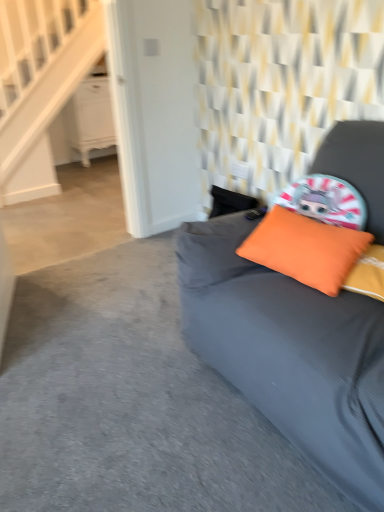
Question: From the image's perspective, is matte gray studio couch at center below orange fabric pillow at upper right?

Choices:
 (A) yes
 (B) no

Answer: (A)

Question: Is matte gray studio couch at center not within orange fabric pillow at upper right?

Choices:
 (A) no
 (B) yes

Answer: (B)

Question: From a real-world perspective, is matte gray studio couch at center positioned over orange fabric pillow at upper right based on gravity?

Choices:
 (A) no
 (B) yes

Answer: (A)

Question: Is matte gray studio couch at center wider than orange fabric pillow at upper right?

Choices:
 (A) no
 (B) yes

Answer: (B)

Question: Does matte gray studio couch at center come in front of orange fabric pillow at upper right?

Choices:
 (A) no
 (B) yes

Answer: (B)

Question: Which is correct: white glossy dresser at upper left is inside matte gray studio couch at center, or outside of it?

Choices:
 (A) inside
 (B) outside

Answer: (B)

Question: Visually, is white glossy dresser at upper left positioned to the left or to the right of matte gray studio couch at center?

Choices:
 (A) right
 (B) left

Answer: (B)

Question: Is point (105, 101) closer or farther from the camera than point (375, 494)?

Choices:
 (A) farther
 (B) closer

Answer: (A)

Question: From their relative heights in the image, would you say white glossy dresser at upper left is taller or shorter than matte gray studio couch at center?

Choices:
 (A) short
 (B) tall

Answer: (A)

Question: From their relative heights in the image, would you say orange fabric pillow at upper right is taller or shorter than matte gray studio couch at center?

Choices:
 (A) short
 (B) tall

Answer: (A)

Question: Considering the positions of orange fabric pillow at upper right and matte gray studio couch at center in the image, is orange fabric pillow at upper right bigger or smaller than matte gray studio couch at center?

Choices:
 (A) small
 (B) big

Answer: (A)

Question: In terms of width, does orange fabric pillow at upper right look wider or thinner when compared to matte gray studio couch at center?

Choices:
 (A) wide
 (B) thin

Answer: (B)

Question: From a real-world perspective, is orange fabric pillow at upper right positioned above or below matte gray studio couch at center?

Choices:
 (A) above
 (B) below

Answer: (A)

Question: From a real-world perspective, is orange fabric pillow at upper right positioned above or below white wood stairwell at upper left?

Choices:
 (A) above
 (B) below

Answer: (B)

Question: From the image's perspective, relative to white wood stairwell at upper left, is orange fabric pillow at upper right above or below?

Choices:
 (A) above
 (B) below

Answer: (B)